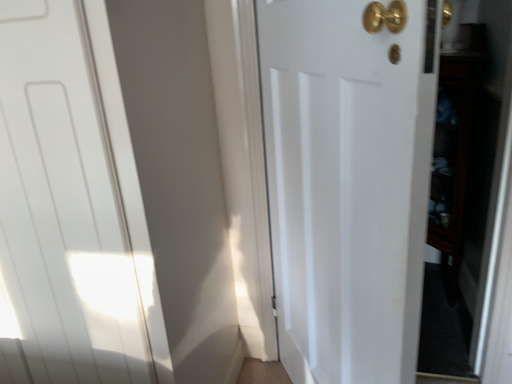
Question: Does dark wood cabinet at right have a lesser height compared to white matte door at center, which ranks as the 2th door in left-to-right order?

Choices:
 (A) yes
 (B) no

Answer: (A)

Question: Is white matte door at center, the 1th door from the right, surrounded by dark wood cabinet at right?

Choices:
 (A) yes
 (B) no

Answer: (B)

Question: Does dark wood cabinet at right appear on the right side of white matte door at center, which ranks as the 2th door in left-to-right order?

Choices:
 (A) yes
 (B) no

Answer: (A)

Question: Is dark wood cabinet at right not within white matte door at center, the 1th door from the right?

Choices:
 (A) no
 (B) yes

Answer: (B)

Question: Could you tell me if dark wood cabinet at right is turned towards white matte door at center, which ranks as the 2th door in left-to-right order?

Choices:
 (A) no
 (B) yes

Answer: (A)

Question: Looking at the image, does white matte door at left, which appears as the 2th door when viewed from the right, seem bigger or smaller compared to dark wood cabinet at right?

Choices:
 (A) big
 (B) small

Answer: (A)

Question: Is point (16, 66) positioned closer to the camera than point (473, 188)?

Choices:
 (A) closer
 (B) farther

Answer: (A)

Question: From the image's perspective, is white matte door at left, which appears as the 2th door when viewed from the right, positioned above or below dark wood cabinet at right?

Choices:
 (A) above
 (B) below

Answer: (B)

Question: Is white matte door at left, which is the first door from left to right, inside or outside of dark wood cabinet at right?

Choices:
 (A) inside
 (B) outside

Answer: (B)

Question: From their relative heights in the image, would you say dark wood cabinet at right is taller or shorter than white matte door at center, the 1th door from the right?

Choices:
 (A) short
 (B) tall

Answer: (A)

Question: In the image, is dark wood cabinet at right positioned in front of or behind white matte door at center, which ranks as the 2th door in left-to-right order?

Choices:
 (A) front
 (B) behind

Answer: (B)

Question: Is dark wood cabinet at right bigger or smaller than white matte door at center, which ranks as the 2th door in left-to-right order?

Choices:
 (A) small
 (B) big

Answer: (A)

Question: Is dark wood cabinet at right spatially inside white matte door at center, which ranks as the 2th door in left-to-right order, or outside of it?

Choices:
 (A) inside
 (B) outside

Answer: (B)

Question: Looking at the image, does white matte door at center, which ranks as the 2th door in left-to-right order, seem bigger or smaller compared to white matte door at left, which appears as the 2th door when viewed from the right?

Choices:
 (A) big
 (B) small

Answer: (B)

Question: From the image's perspective, relative to white matte door at left, which appears as the 2th door when viewed from the right, is white matte door at center, the 1th door from the right, above or below?

Choices:
 (A) above
 (B) below

Answer: (B)